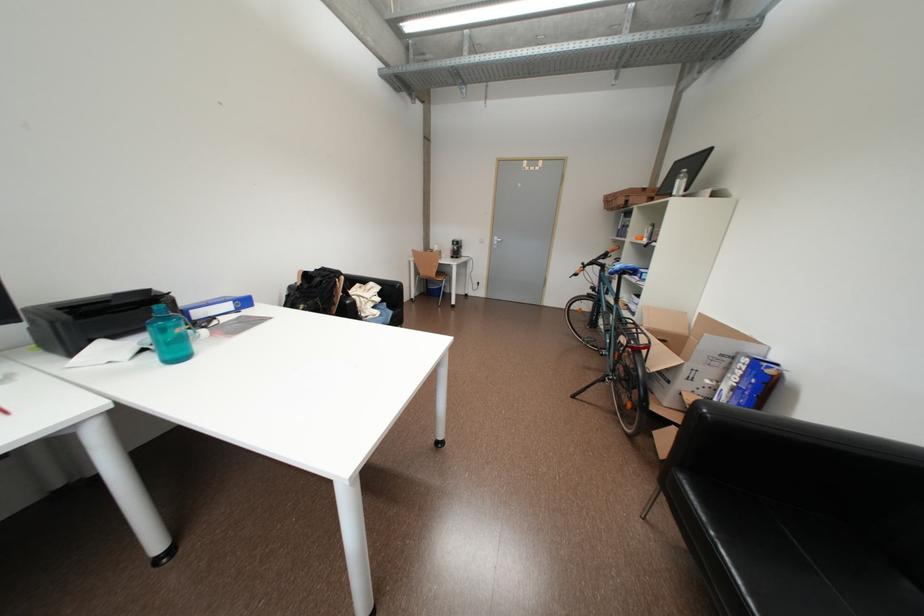
What do you see at coordinates (601, 270) in the screenshot?
I see `the orange bicycle grip` at bounding box center [601, 270].